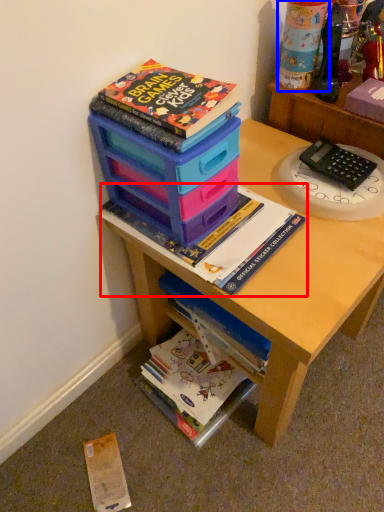
Question: Which point is closer to the camera, book (highlighted by a red box) or toy (highlighted by a blue box)?

Choices:
 (A) book
 (B) toy

Answer: (A)